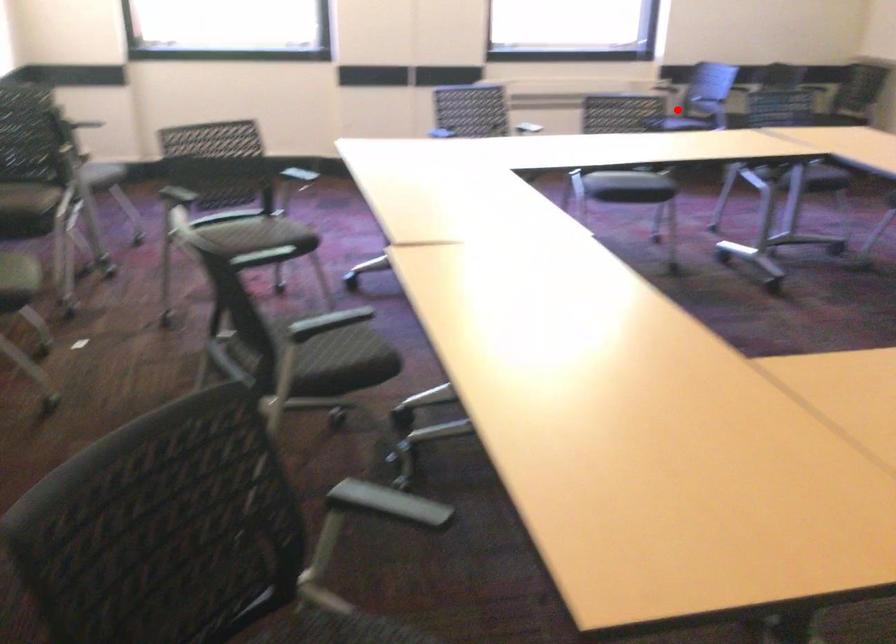
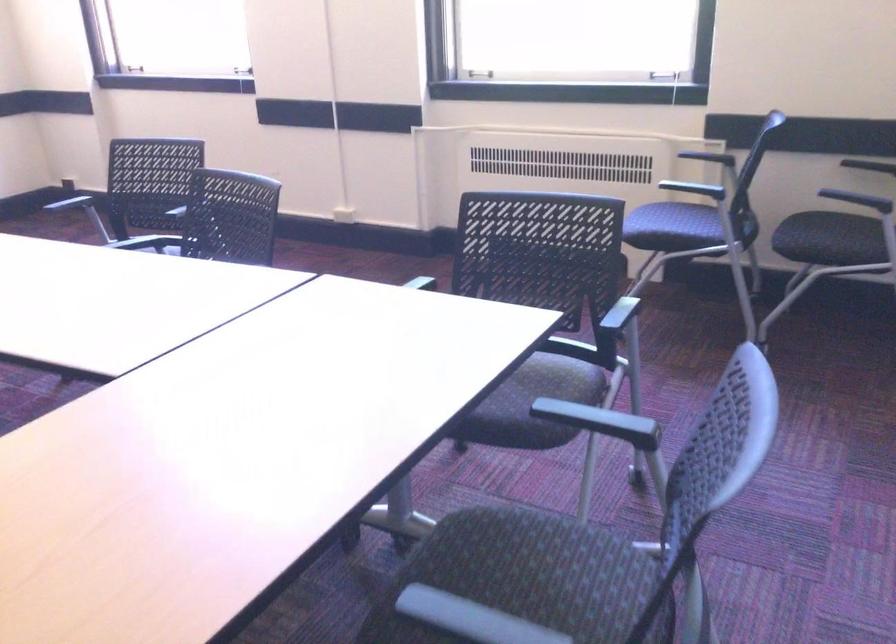
In the second image, find the point that corresponds to the highlighted location in the first image.

(662, 220)